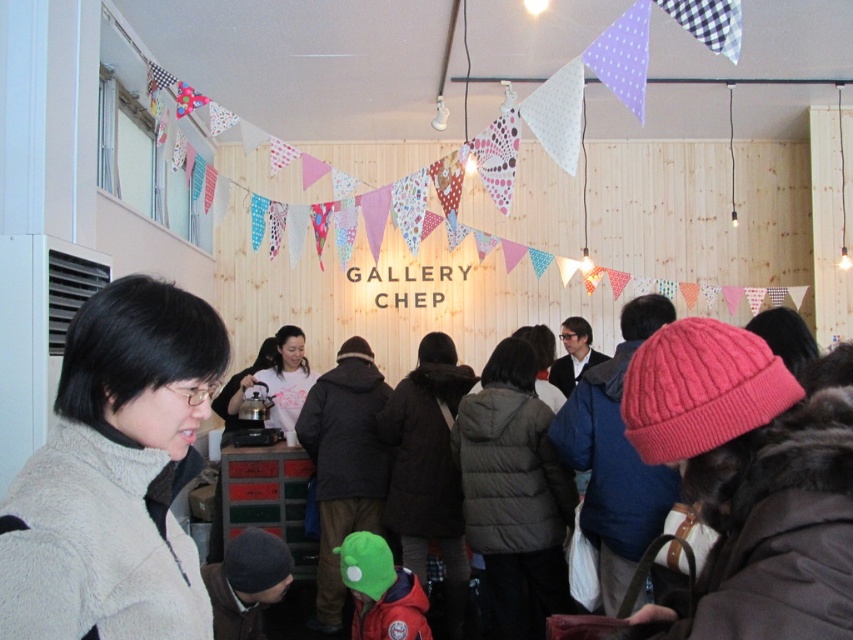
You are at the Gallery Chep event and want to meet someone wearing a dark gray puffer jacket at center. Where should you look to find them?

The dark gray puffer jacket at center is located at point (514, 493).

You are a photographer at Gallery Chep and need to take a closeup shot of the gray fleece jacket at lower left. The camera you are using has a minimum focusing distance of 1 meter. Can you take the photo without moving the jacket?

The gray fleece jacket at lower left is 92.66 centimeters away from camera, which is less than 1 meter. Therefore, the camera cannot focus on it because it is too close.

You are attending Gallery Chep and notice two people wearing a dark gray puffer jacket at center and a white matte shirt at center. Which clothing item is positioned lower on the person?

The dark gray puffer jacket at center is positioned lower because it is below the white matte shirt at center.